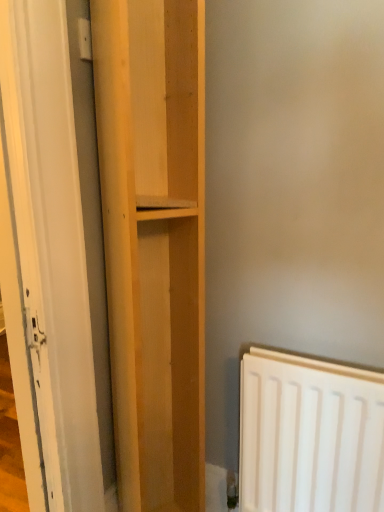
Question: From the image's perspective, would you say white glossy door at left is positioned over light wood shelf at center?

Choices:
 (A) no
 (B) yes

Answer: (B)

Question: From a real-world perspective, is white glossy door at left on light wood shelf at center?

Choices:
 (A) no
 (B) yes

Answer: (B)

Question: Is white glossy door at left thinner than light wood shelf at center?

Choices:
 (A) no
 (B) yes

Answer: (B)

Question: Is white glossy door at left positioned far away from light wood shelf at center?

Choices:
 (A) no
 (B) yes

Answer: (A)

Question: Is white glossy door at left positioned behind light wood shelf at center?

Choices:
 (A) yes
 (B) no

Answer: (B)

Question: Is the depth of white glossy door at left less than that of light wood shelf at center?

Choices:
 (A) yes
 (B) no

Answer: (A)

Question: Considering the relative positions of light wood shelf at center and white glossy door at left in the image provided, is light wood shelf at center to the right of white glossy door at left from the viewer's perspective?

Choices:
 (A) yes
 (B) no

Answer: (A)

Question: Is white glossy door at left completely or partially inside light wood shelf at center?

Choices:
 (A) no
 (B) yes

Answer: (A)

Question: Is light wood shelf at center bigger than white glossy door at left?

Choices:
 (A) no
 (B) yes

Answer: (B)

Question: Can you confirm if light wood shelf at center is wider than white glossy door at left?

Choices:
 (A) no
 (B) yes

Answer: (B)

Question: Is light wood shelf at center aimed at white glossy door at left?

Choices:
 (A) yes
 (B) no

Answer: (B)

Question: Can you confirm if light wood shelf at center is shorter than white glossy door at left?

Choices:
 (A) no
 (B) yes

Answer: (A)

Question: Looking at the image, does white glossy door at left seem bigger or smaller compared to light wood shelf at center?

Choices:
 (A) small
 (B) big

Answer: (A)